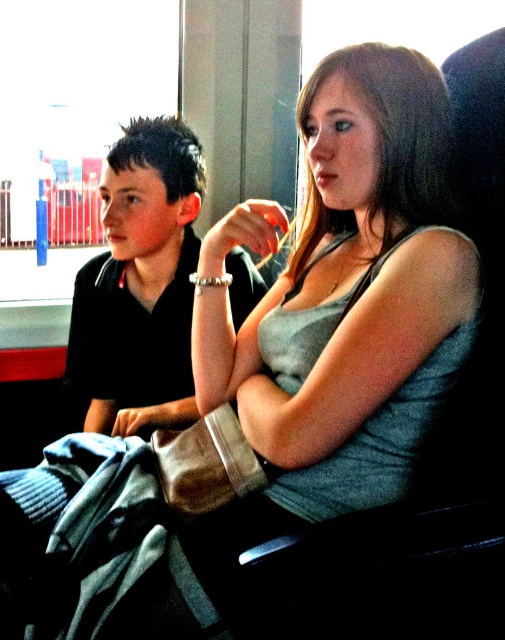
You are a fashion designer observing two people in a vehicle. You need to determine which garment has a larger size between the gray cotton tank top at center and the black matte shirt at left. Based on the scene, which one is bigger?

The gray cotton tank top at center has a larger size compared to the black matte shirt at left, so the gray cotton tank top at center is bigger.

In the scene shown: You are a passenger in the vehicle and want to place a small bag on the seat between the two people. The seat coordinates are from point A at 0.3 to point B at 0.8. Can the bag be placed between the two people without overlapping the gray cotton tank top at center?

The gray cotton tank top at center is located at point 0.687, which is within the seat coordinates from 0.3 to 0.8. Therefore, placing the bag between the two people might overlap with the gray cotton tank top at center, so it is not advisable.

You are a fashion designer observing two outfits in a photo. You see a gray cotton tank top at center and a black matte shirt at left. Which of the two outfits has a longer length?

The gray cotton tank top at center is taller than black matte shirt at left, so the gray cotton tank top at center has a longer length.